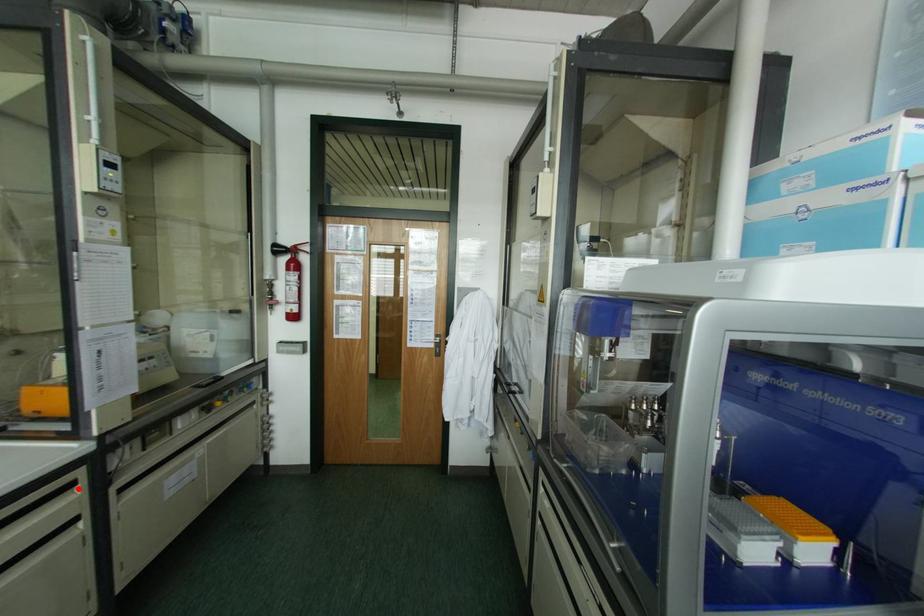
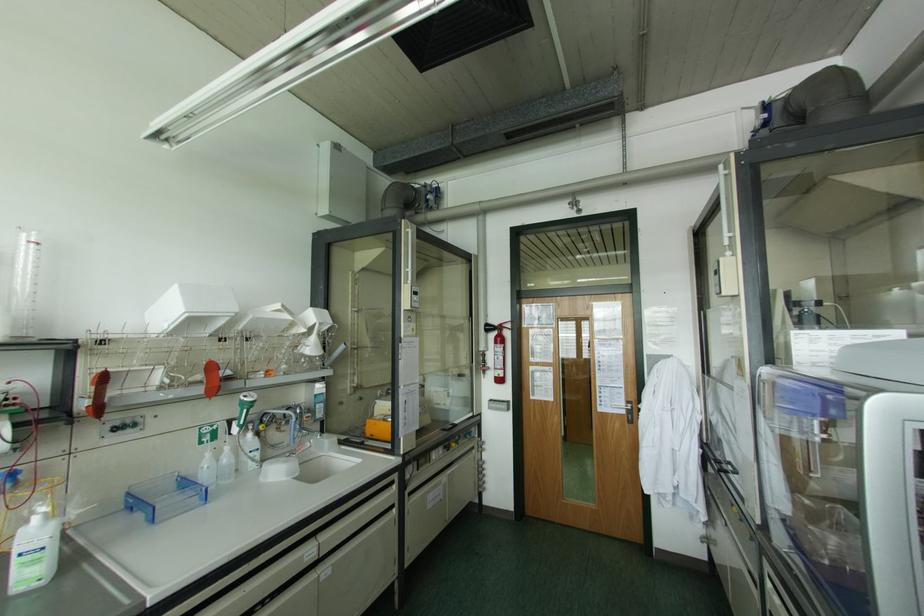
Locate, in the second image, the point that corresponds to the highlighted location in the first image.

(394, 485)